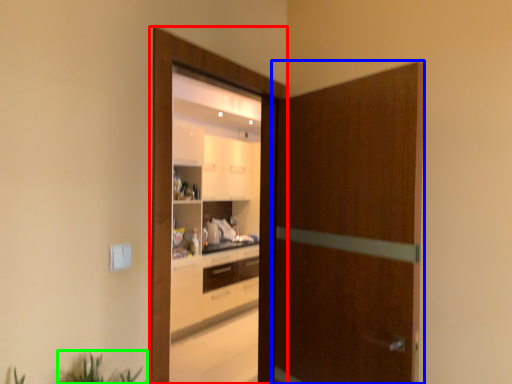
Question: Considering the real-world distances, which object is farthest from screen door (highlighted by a red box)? screen door (highlighted by a blue box) or plant (highlighted by a green box)?

Choices:
 (A) screen door
 (B) plant

Answer: (B)